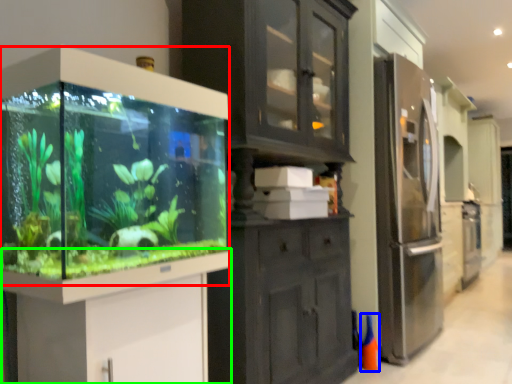
Question: Which object is the farthest from glass box (highlighted by a red box)? Choose among these: cone (highlighted by a blue box) or vanity (highlighted by a green box).

Choices:
 (A) cone
 (B) vanity

Answer: (A)